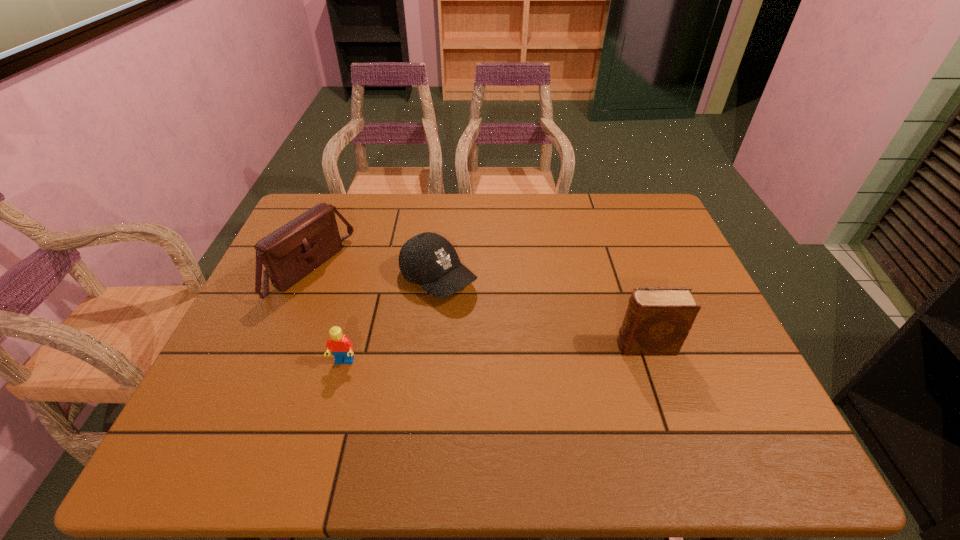
Where is `free space between the shoulder bag and the diary`? The height and width of the screenshot is (540, 960). free space between the shoulder bag and the diary is located at coordinates (477, 307).

Select which object appears as the third closest to the third object from left to right. Please provide its 2D coordinates. Your answer should be formatted as a tuple, i.e. [(x, y)], where the tuple contains the x and y coordinates of a point satisfying the conditions above.

[(657, 321)]

Point out which object is positioned as the nearest to the leftmost object. Please provide its 2D coordinates. Your answer should be formatted as a tuple, i.e. [(x, y)], where the tuple contains the x and y coordinates of a point satisfying the conditions above.

[(428, 259)]

Identify the location of vacant space that satisfies the following two spatial constraints: 1. on the front side of the second object from right to left; 2. on the spine side of the diary. (431, 346).